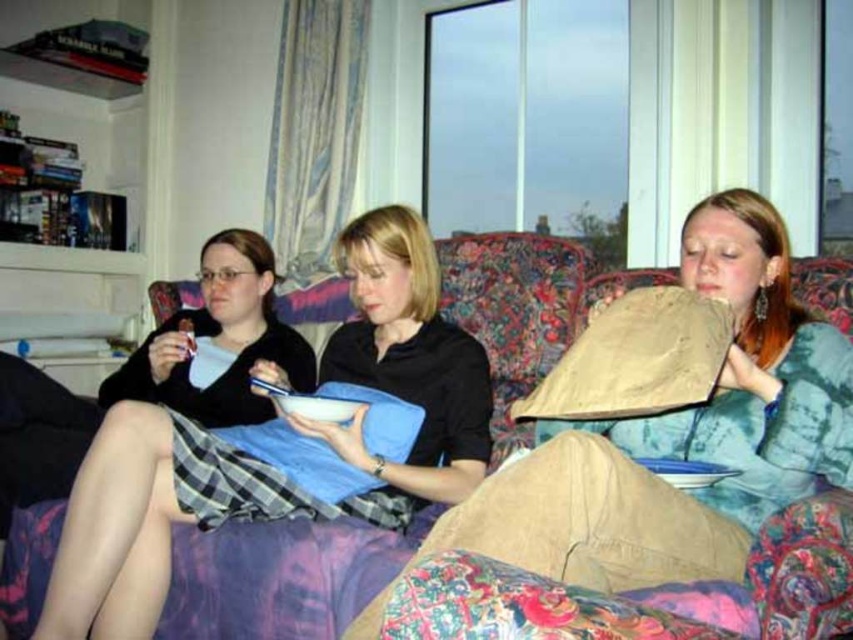
Question: Can you confirm if floral fabric couch at center is positioned above white matte bowl at center?

Choices:
 (A) yes
 (B) no

Answer: (A)

Question: Which object appears farthest from the camera in this image?

Choices:
 (A) white matte bowl at center
 (B) floral fabric couch at center

Answer: (A)

Question: Is floral fabric couch at center positioned before white matte bowl at center?

Choices:
 (A) no
 (B) yes

Answer: (B)

Question: Can you confirm if floral fabric couch at center is positioned to the right of white matte bowl at center?

Choices:
 (A) yes
 (B) no

Answer: (A)

Question: Among these objects, which one is farthest from the camera?

Choices:
 (A) floral fabric couch at center
 (B) white matte bowl at center

Answer: (B)